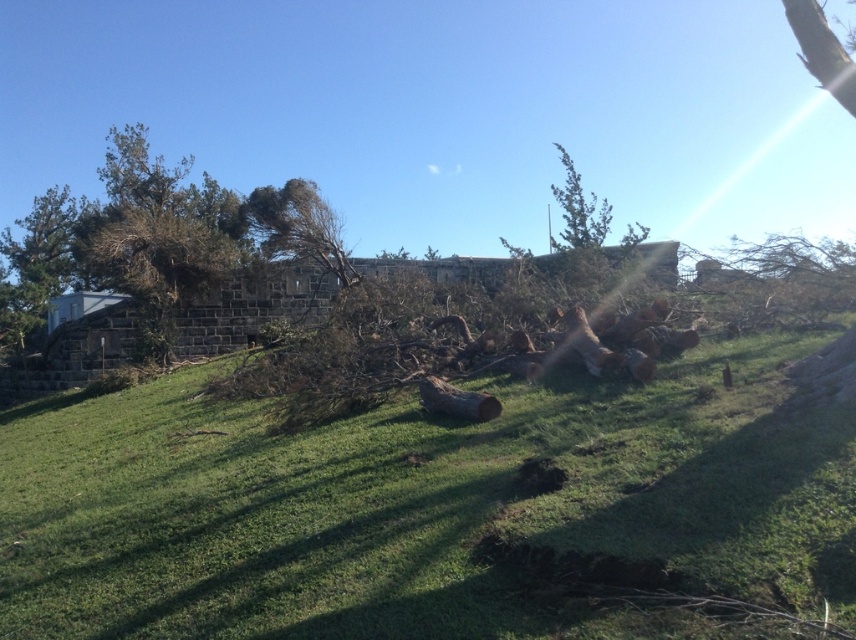
Question: Does green leafy tree at upper left have a smaller size compared to brown rough log at center?

Choices:
 (A) yes
 (B) no

Answer: (B)

Question: Considering the real-world distances, which object is farthest from the green grassy at center?

Choices:
 (A) green leafy tree at upper center
 (B) green leafy tree at upper left
 (C) brown rough log at center

Answer: (B)

Question: Which point is closer to the camera?

Choices:
 (A) (150, 237)
 (B) (563, 168)
 (C) (424, 385)

Answer: (C)

Question: Is the position of green leafy tree at upper left less distant than that of brown rough log at center?

Choices:
 (A) no
 (B) yes

Answer: (A)

Question: Which object appears closest to the camera in this image?

Choices:
 (A) green leafy tree at upper center
 (B) green grassy at center
 (C) green leafy tree at upper left
 (D) brown rough log at center

Answer: (B)

Question: Can you confirm if green leafy tree at upper center is positioned to the right of brown rough log at center?

Choices:
 (A) yes
 (B) no

Answer: (A)